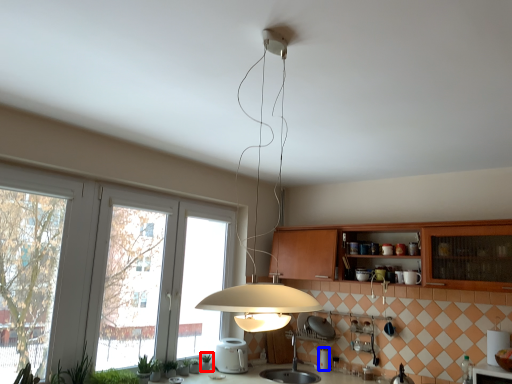
Question: Which of the following is the farthest to the observer, plant (highlighted by a red box) or appliance (highlighted by a blue box)?

Choices:
 (A) plant
 (B) appliance

Answer: (B)